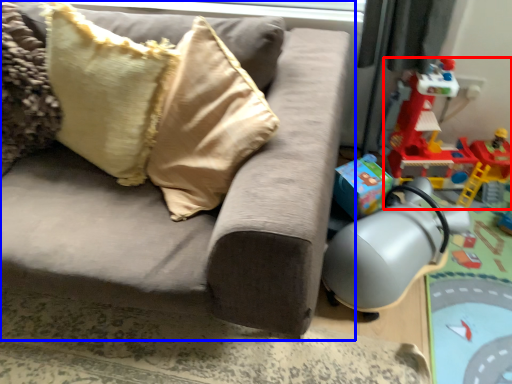
Question: Which object appears farthest to the camera in this image, toy (highlighted by a red box) or studio couch (highlighted by a blue box)?

Choices:
 (A) toy
 (B) studio couch

Answer: (A)